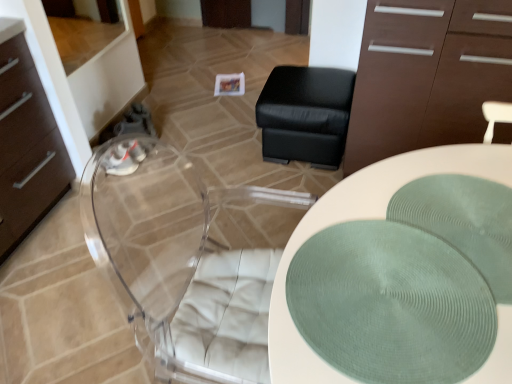
Identify the location of blank area to the left of green textured placemat at center. (350, 269).